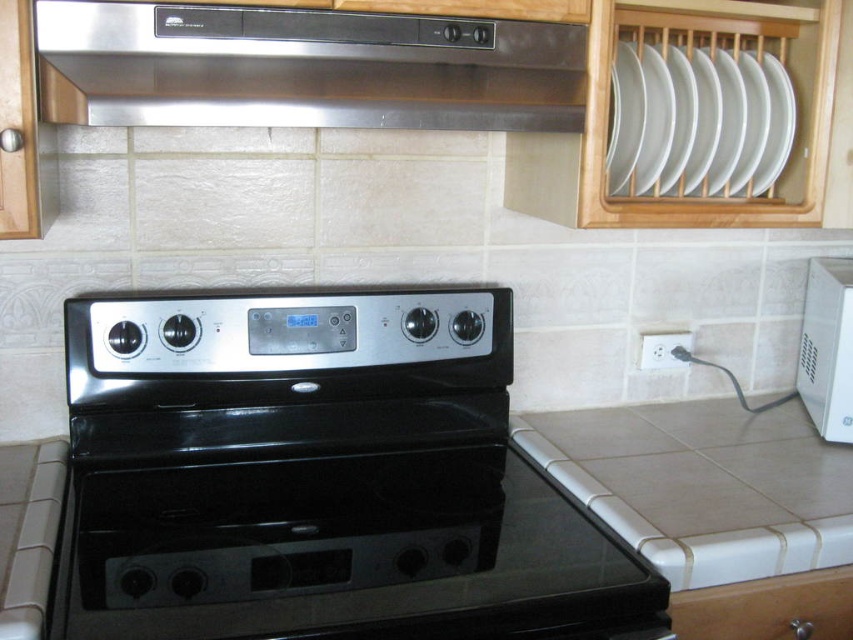
Which is in front, point (347, 10) or point (669, 576)?

Positioned in front is point (347, 10).

Does point (115, 67) come in front of point (645, 440)?

Yes, point (115, 67) is in front of point (645, 440).

The width and height of the screenshot is (853, 640). What are the coordinates of `stainless steel exhaust hood at upper center` in the screenshot? It's located at (305, 68).

Which is behind, point (337, 317) or point (709, 604)?

The point (337, 317) is behind.

Who is more distant from viewer, (x=576, y=524) or (x=674, y=620)?

Positioned behind is point (x=576, y=524).

Where is `black glossy oven at center`? The width and height of the screenshot is (853, 640). black glossy oven at center is located at coordinates (318, 477).

Between white tile countertop at lower right and white glossy microwave at right, which one has more height?

white glossy microwave at right is taller.

Looking at this image, is white tile countertop at lower right closer to camera compared to white glossy microwave at right?

Yes, white tile countertop at lower right is in front of white glossy microwave at right.

Is point (842, 492) closer to camera compared to point (817, 337)?

Yes, it is.

The height and width of the screenshot is (640, 853). In order to click on white tile countertop at lower right in this screenshot , I will do `click(703, 484)`.